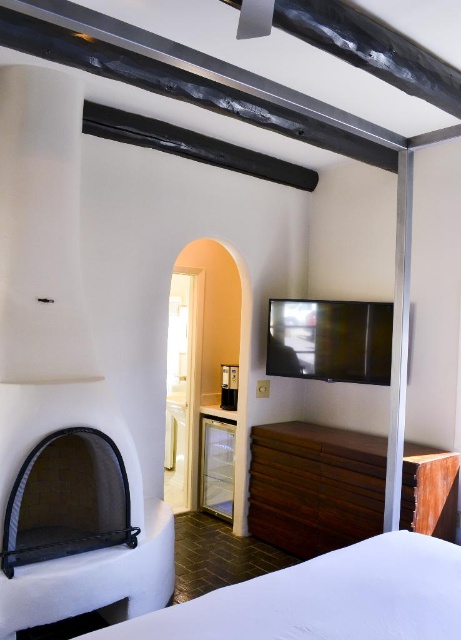
Question: Does white soft bed at lower right have a larger size compared to black mesh fireplace at lower left?

Choices:
 (A) yes
 (B) no

Answer: (B)

Question: Which point appears farthest from the camera in this image?

Choices:
 (A) (413, 596)
 (B) (117, 448)
 (C) (342, 484)

Answer: (C)

Question: Is white soft bed at lower right to the left of black mesh fireplace at lower left from the viewer's perspective?

Choices:
 (A) no
 (B) yes

Answer: (A)

Question: Does dark brown wood dresser at center appear over black mesh fireplace at lower left?

Choices:
 (A) yes
 (B) no

Answer: (B)

Question: Which object is closer to the camera taking this photo?

Choices:
 (A) dark brown wood dresser at center
 (B) black mesh fireplace at lower left
 (C) white soft bed at lower right

Answer: (C)

Question: Among these points, which one is farthest from the camera?

Choices:
 (A) (278, 493)
 (B) (122, 461)
 (C) (433, 612)

Answer: (A)